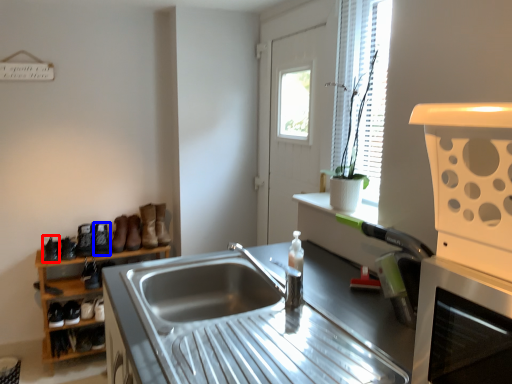
Question: Which point is closer to the camera, shoe (highlighted by a red box) or boot (highlighted by a blue box)?

Choices:
 (A) shoe
 (B) boot

Answer: (A)